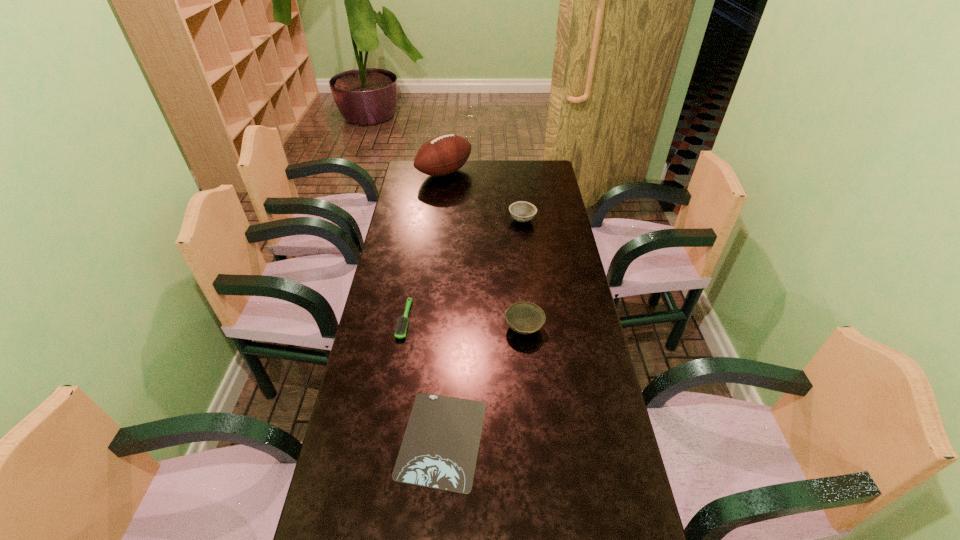
Identify the location of the tallest object. (444, 154).

In order to click on football (American) in this screenshot , I will do `click(444, 154)`.

Image resolution: width=960 pixels, height=540 pixels. Identify the location of the nearer bowl. (523, 317).

In order to click on the farther bowl in this screenshot , I will do `click(522, 211)`.

You are a GUI agent. You are given a task and a screenshot of the screen. Output one action in this format:
    pyautogui.click(x=<x>, y=<y>)
    Task: Click on the hairbrush
    
    Given the screenshot: What is the action you would take?
    pyautogui.click(x=400, y=331)

The height and width of the screenshot is (540, 960). Identify the location of the shortest object. (439, 450).

The image size is (960, 540). What are the coordinates of `the nearest object` in the screenshot? It's located at (439, 450).

Find the location of a particular element. vacant space positioned 0.360m on the front of the farthest object is located at coordinates pyautogui.click(x=438, y=232).

At what (x,y) coordinates should I click in order to perform the action: click on free spot located on the left of the nearer bowl. Please return your answer as a coordinate pair (x, y). This screenshot has height=540, width=960. Looking at the image, I should click on (476, 328).

The height and width of the screenshot is (540, 960). I want to click on free space located on the back of the farther bowl, so click(518, 190).